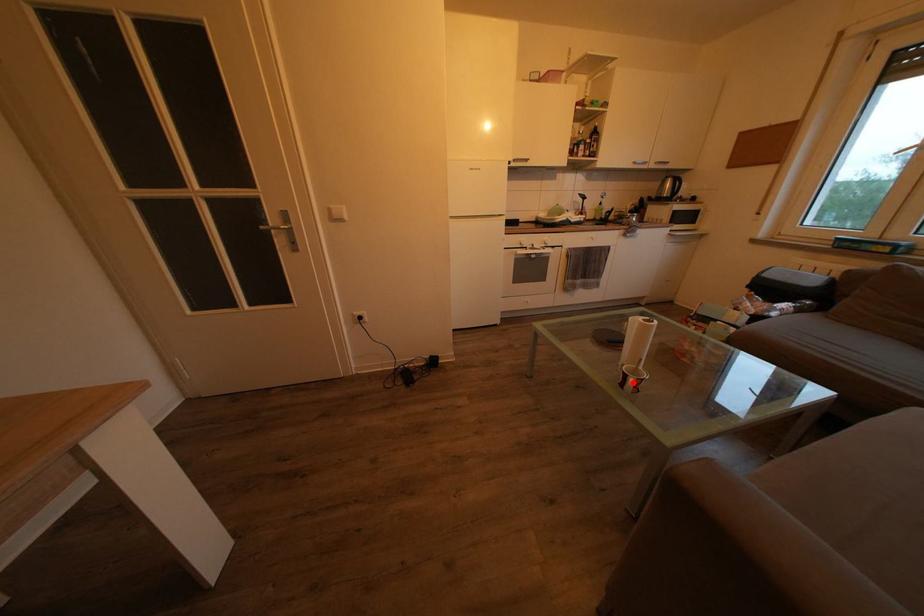
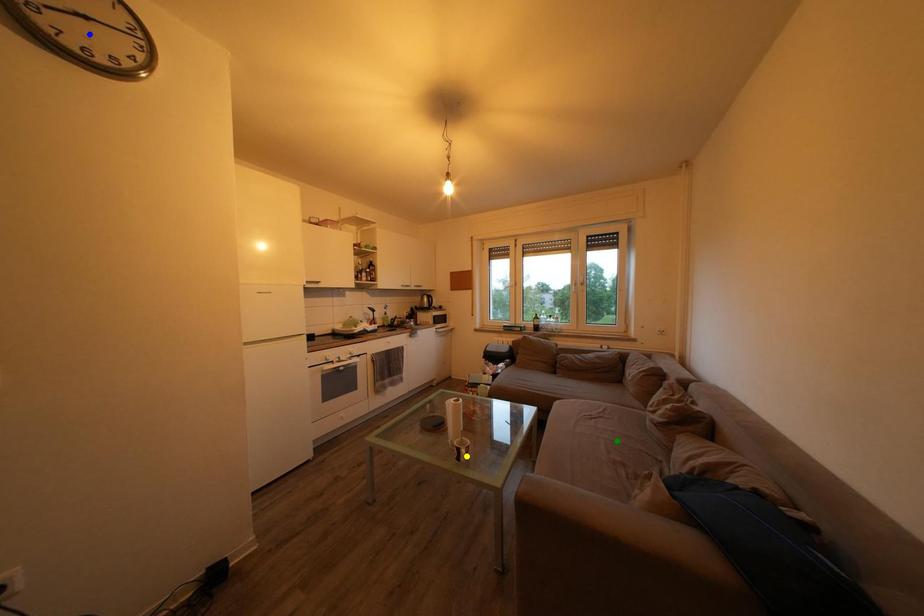
Question: I am providing you with two images of the same scene from different viewpoints. A red point is marked on the first image. You are given multiple points on the second image. Which spot in image 2 lines up with the point in image 1?

Choices:
 (A) green point
 (B) yellow point
 (C) blue point

Answer: (B)